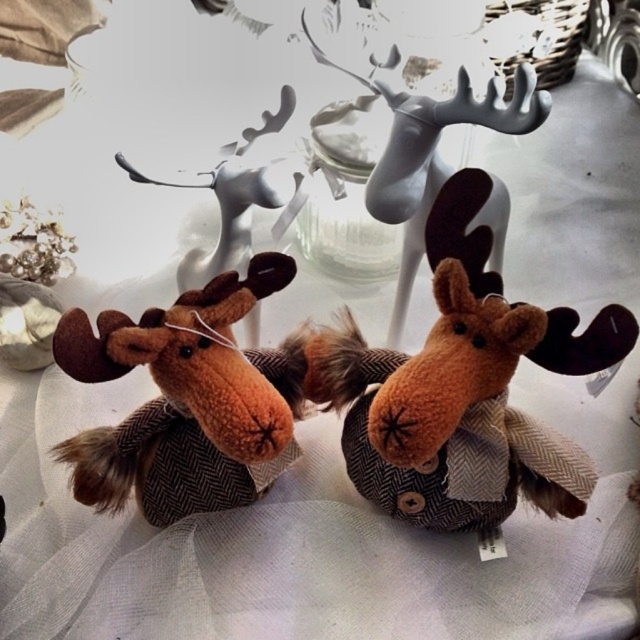
Who is more distant from viewer, (160,483) or (426,104)?

The point (160,483) is more distant.

Who is positioned more to the left, brown fuzzy moose at center or matte white antlers at upper center?

Positioned to the left is brown fuzzy moose at center.

The width and height of the screenshot is (640, 640). What are the coordinates of `brown fuzzy moose at center` in the screenshot? It's located at (188, 401).